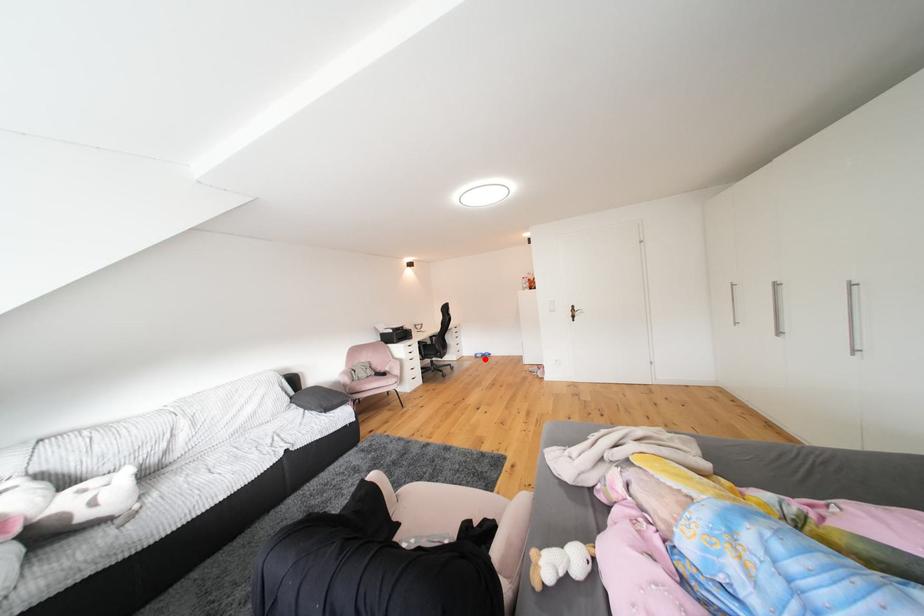
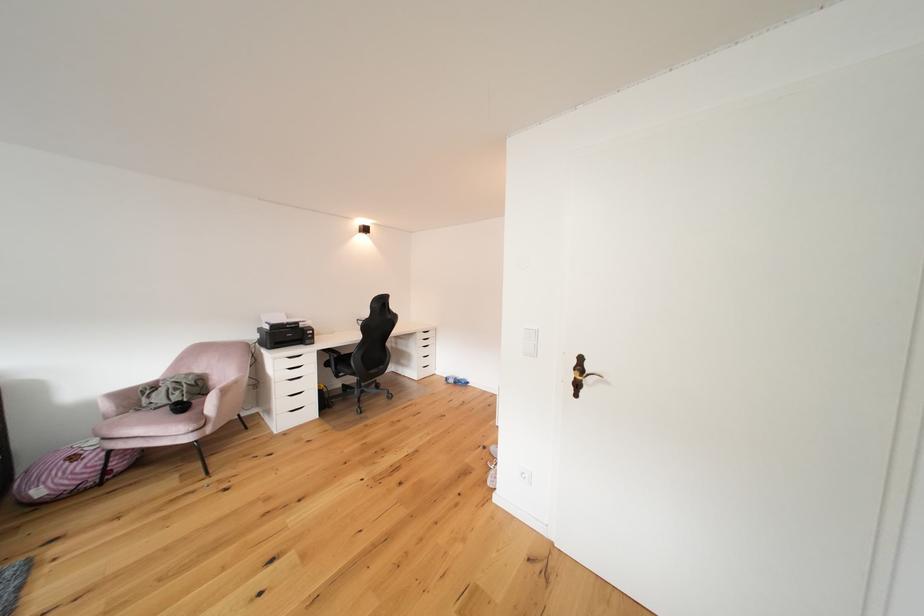
Find the pixel in the second image that matches the highlighted location in the first image.

(456, 383)